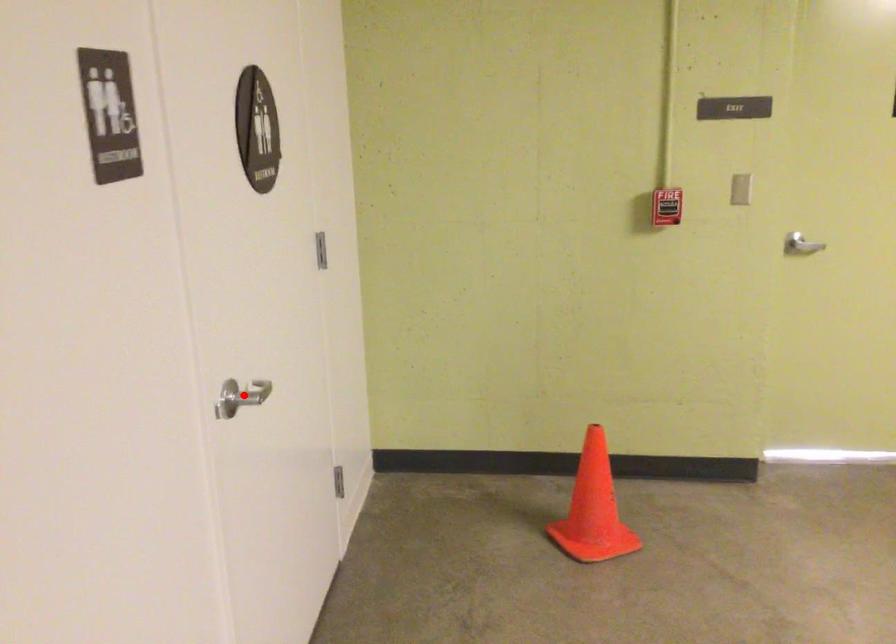
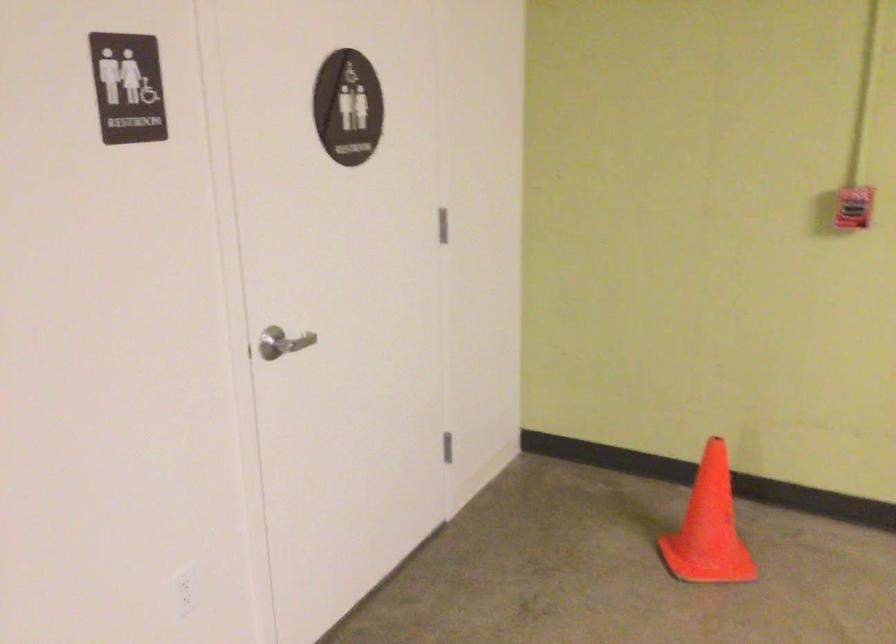
Question: I am providing you with two images of the same scene from different viewpoints. A red point is shown in image1. For the corresponding object point in image2, is it positioned nearer or farther from the camera?

Choices:
 (A) Nearer
 (B) Farther

Answer: (B)